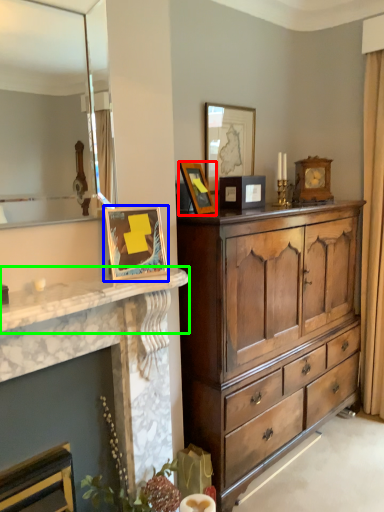
Question: Considering the real-world distances, which object is farthest from picture frame (highlighted by a red box)? picture frame (highlighted by a blue box) or countertop (highlighted by a green box)?

Choices:
 (A) picture frame
 (B) countertop

Answer: (B)